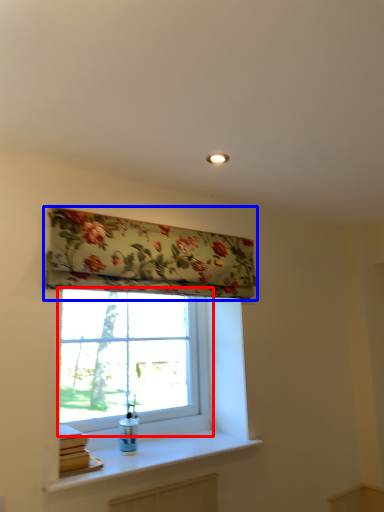
Question: Among these objects, which one is farthest to the camera, window (highlighted by a red box) or window blind (highlighted by a blue box)?

Choices:
 (A) window
 (B) window blind

Answer: (A)